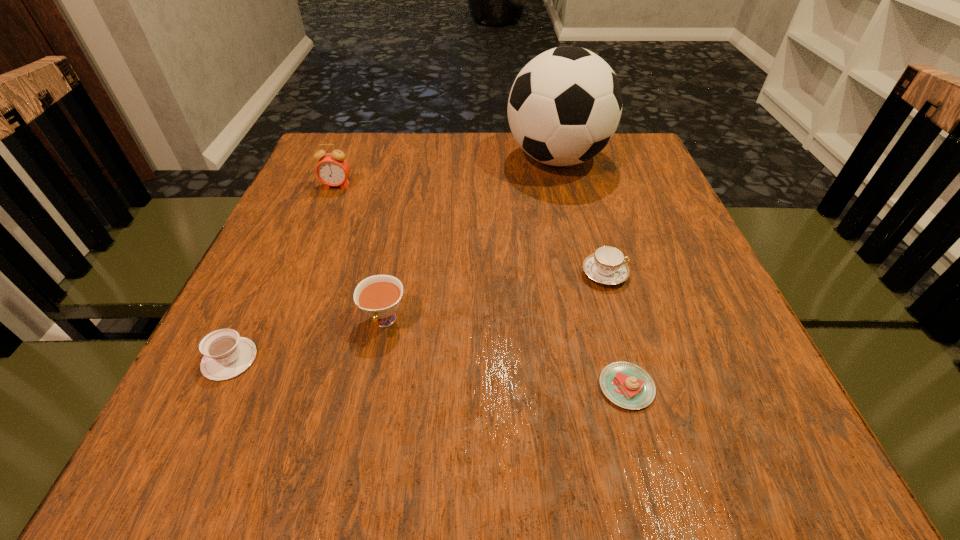
Locate an element on the screen. free spot that satisfies the following two spatial constraints: 1. on the face of the second tallest object; 2. on the handle side of the leftmost teacup is located at coordinates (266, 359).